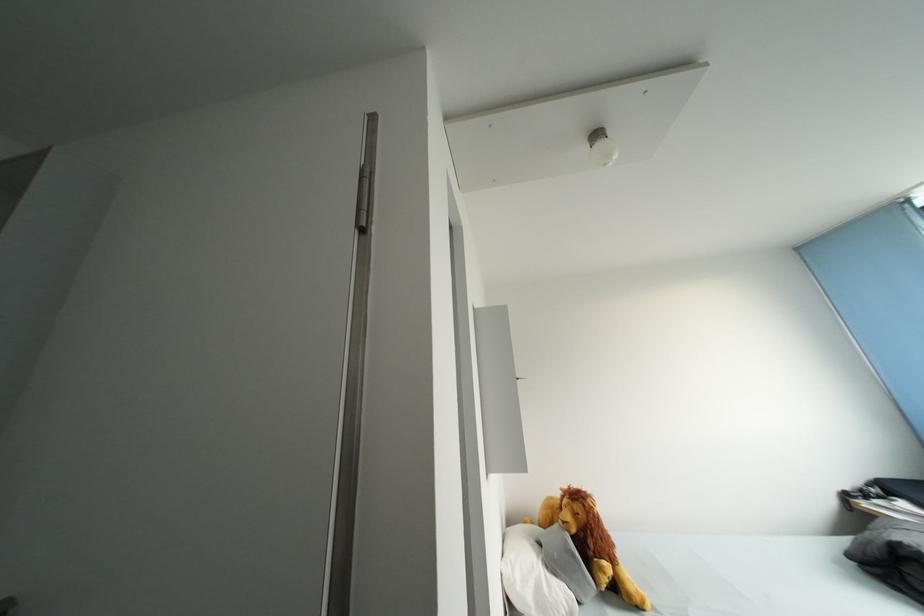
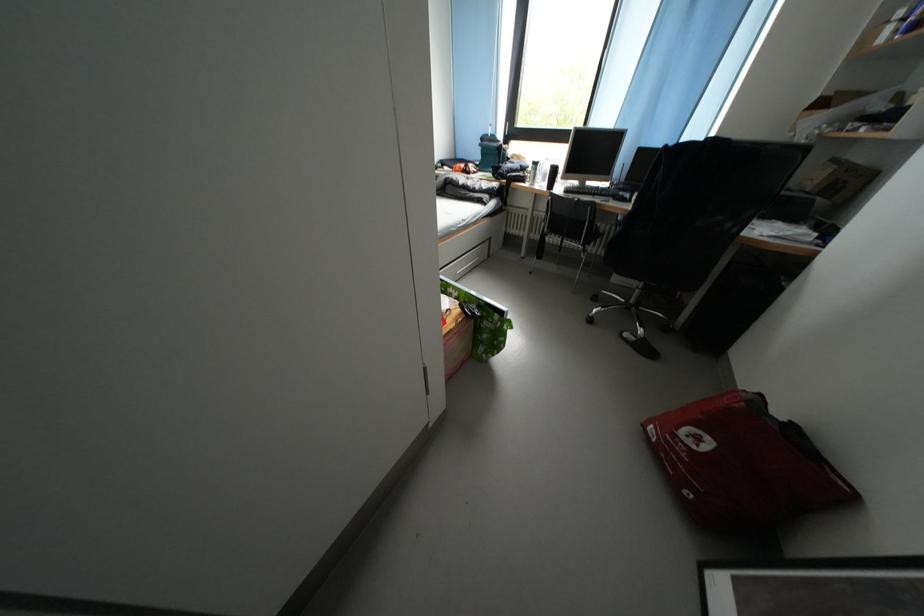
The first image is from the beginning of the video and the second image is from the end. How did the camera likely rotate when shooting the video?

The rotation direction of the camera is right-down.